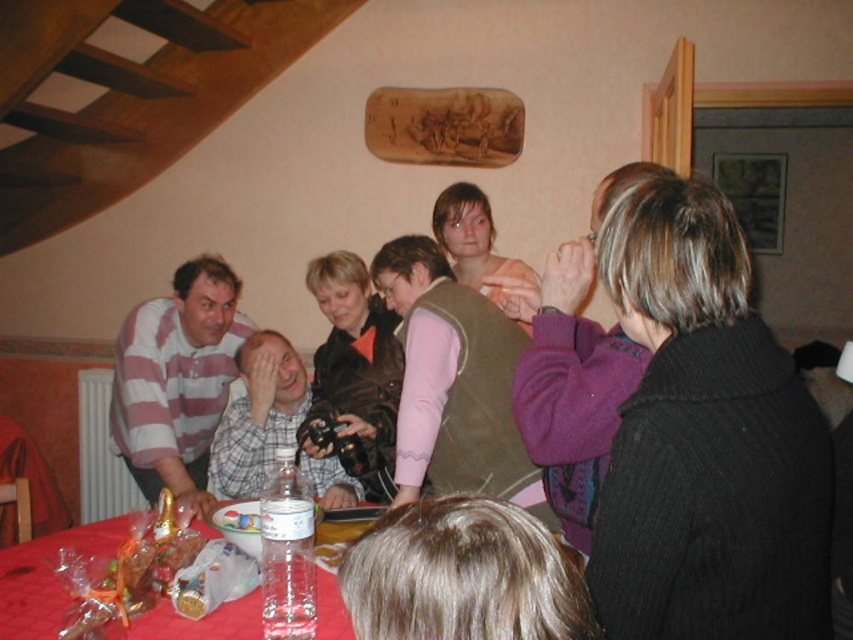
You are standing in the room and want to place a small decoration between the two points, point 1 at point (x=653, y=502) and point 2 at point (x=181, y=420). Which point should the decoration be closer to if you want it to appear larger in the viewer perspective?

The decoration should be placed closer to point 1 at point (x=653, y=502) because it is closer to the viewer, making it appear larger in perspective compared to point 2 at point (x=181, y=420) which is further away.

You are a photographer trying to capture a closeup shot of the translucent plastic table at lower center. The matte black camera at center is currently 72.39 centimeters away from the table. Do you need to move closer or farther away to get a better closeup?

To capture a closeup shot of the translucent plastic table at lower center, you need to move closer since the matte black camera at center is currently 72.39 centimeters away, which is farther than the ideal distance for a closeup.